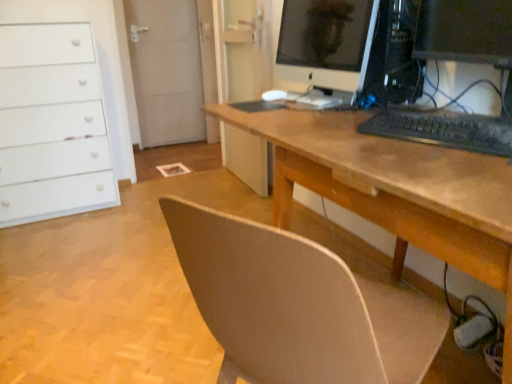
Question: From the image's perspective, is black plastic keyboard at right under white matte chest of drawers at left?

Choices:
 (A) yes
 (B) no

Answer: (A)

Question: Is black plastic keyboard at right next to white matte chest of drawers at left?

Choices:
 (A) no
 (B) yes

Answer: (A)

Question: Considering the relative positions of black plastic keyboard at right and white matte chest of drawers at left in the image provided, is black plastic keyboard at right to the right of white matte chest of drawers at left from the viewer's perspective?

Choices:
 (A) no
 (B) yes

Answer: (B)

Question: Can you confirm if black plastic keyboard at right is smaller than white matte chest of drawers at left?

Choices:
 (A) no
 (B) yes

Answer: (B)

Question: Considering the relative positions of black plastic keyboard at right and white matte chest of drawers at left in the image provided, is black plastic keyboard at right to the left of white matte chest of drawers at left from the viewer's perspective?

Choices:
 (A) yes
 (B) no

Answer: (B)

Question: Is black plastic keyboard at right bigger than white matte chest of drawers at left?

Choices:
 (A) yes
 (B) no

Answer: (B)

Question: Is white matte chest of drawers at left oriented towards wooden desk at center?

Choices:
 (A) yes
 (B) no

Answer: (B)

Question: From a real-world perspective, is white matte chest of drawers at left under wooden desk at center?

Choices:
 (A) no
 (B) yes

Answer: (A)

Question: Is white matte chest of drawers at left positioned in front of wooden desk at center?

Choices:
 (A) no
 (B) yes

Answer: (A)

Question: Is white matte chest of drawers at left shorter than wooden desk at center?

Choices:
 (A) no
 (B) yes

Answer: (A)

Question: Would you say white matte chest of drawers at left contains wooden desk at center?

Choices:
 (A) yes
 (B) no

Answer: (B)

Question: Considering the relative sizes of white matte chest of drawers at left and wooden desk at center in the image provided, is white matte chest of drawers at left smaller than wooden desk at center?

Choices:
 (A) yes
 (B) no

Answer: (A)

Question: Is satin black monitor at center outside black matte keyboard at center?

Choices:
 (A) yes
 (B) no

Answer: (A)